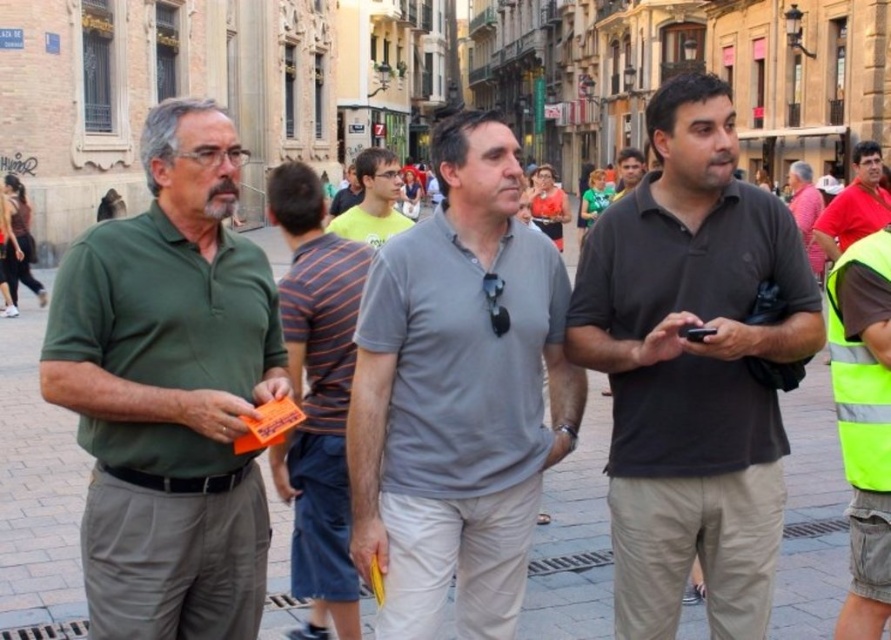
You are a photographer standing on the cobblestone street in front of the European city buildings. You see the green matte shirt at left and the gray cotton shirt at center. Which of these two men is standing closer to you?

The green matte shirt at left is taller than the gray cotton shirt at center, so the green matte shirt at left is closer to you because objects that are closer appear larger.

Consider the image. What is the spatial relationship between the green matte shirt at left and the point represented by coordinates (x=169, y=392)?

The green matte shirt at left is represented by point (x=169, y=392).